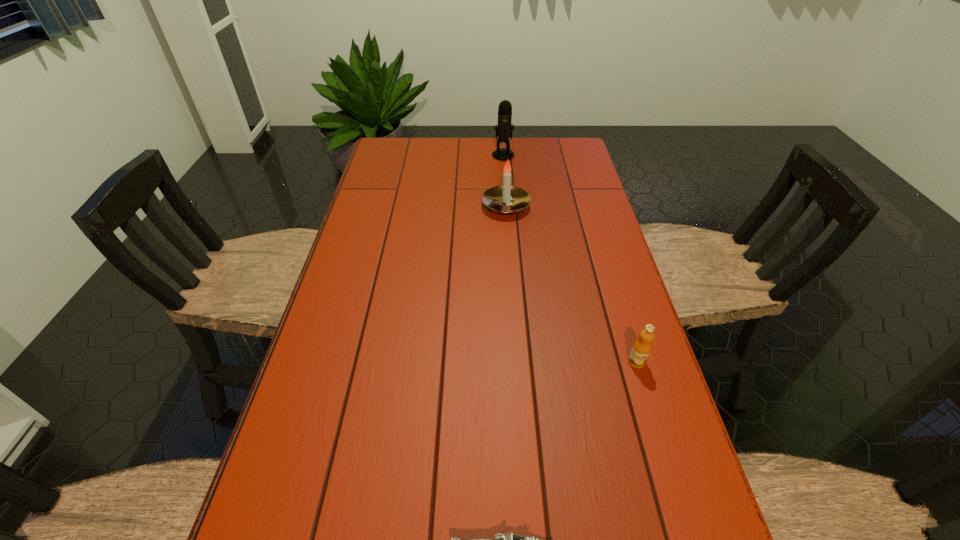
What are the coordinates of `the farthest object` in the screenshot? It's located at (504, 130).

Locate an element on the screen. The height and width of the screenshot is (540, 960). microphone is located at coordinates (504, 130).

At what (x,y) coordinates should I click in order to perform the action: click on candle. Please return your answer as a coordinate pair (x, y). This screenshot has height=540, width=960. Looking at the image, I should click on (505, 199).

The height and width of the screenshot is (540, 960). What are the coordinates of `the third shortest object` in the screenshot? It's located at (505, 199).

You are a GUI agent. You are given a task and a screenshot of the screen. Output one action in this format:
    pyautogui.click(x=<x>, y=<y>)
    Task: Click on the second shortest object
    The height and width of the screenshot is (540, 960).
    Given the screenshot: What is the action you would take?
    pyautogui.click(x=642, y=347)

What are the coordinates of `the rightmost object` in the screenshot? It's located at (642, 347).

I want to click on free location located 0.130m on the right of the microphone, so click(x=549, y=155).

Where is `vacant space located 0.220m on the right of the candle`? vacant space located 0.220m on the right of the candle is located at coordinates (599, 206).

You are a GUI agent. You are given a task and a screenshot of the screen. Output one action in this format:
    pyautogui.click(x=<x>, y=<y>)
    Task: Click on the vacant space located on the front label of the orange juice
    Image resolution: width=960 pixels, height=540 pixels.
    Given the screenshot: What is the action you would take?
    pyautogui.click(x=661, y=444)

You are a GUI agent. You are given a task and a screenshot of the screen. Output one action in this format:
    pyautogui.click(x=<x>, y=<y>)
    Task: Click on the object that is positioned at the far edge
    The width and height of the screenshot is (960, 540).
    Given the screenshot: What is the action you would take?
    pyautogui.click(x=504, y=130)